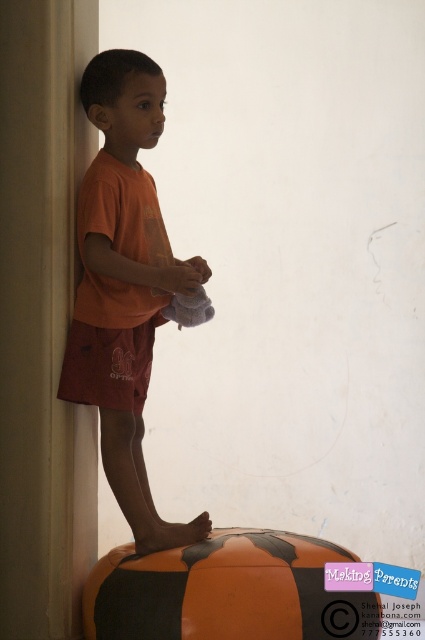
Looking at this image, you are a child who wants to stand on the orange matte beach ball at lower center. Is there enough space between the smooth beige pillar at left and the ball for you to balance?

The smooth beige pillar at left is thinner than the orange matte beach ball at lower center, so there should be enough space between them for you to balance on the ball.

You are a photographer setting up a shoot in this room. You need to position a camera so it can capture both the smooth beige pillar at left and the orange cotton shorts at lower left without any obstruction. Based on their positions, which object should you place closer to the camera to ensure both are visible?

The smooth beige pillar at left is in front of the orange cotton shorts at lower left, so you should place the smooth beige pillar at left closer to the camera to ensure both are visible without obstruction.

You are a painter who needs to place a small stool between the smooth beige pillar at left and the orange cotton shorts at lower left. Which object should the stool be closer to to ensure it doesn

The stool should be placed closer to the orange cotton shorts at lower left because the smooth beige pillar at left is taller than the orange cotton shorts at lower left, so the shorter object requires less clearance.